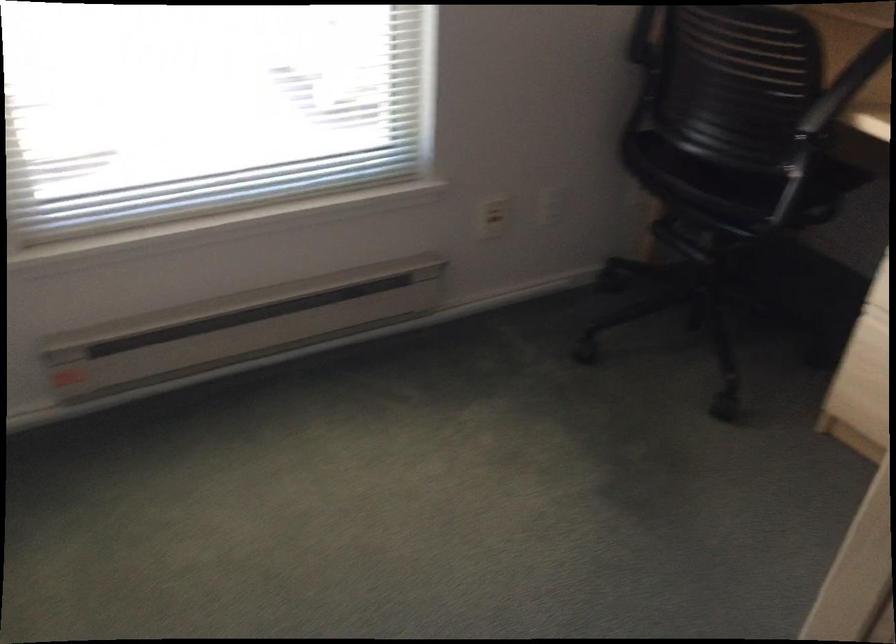
Describe the element at coordinates (730, 182) in the screenshot. I see `the chair sitting surface` at that location.